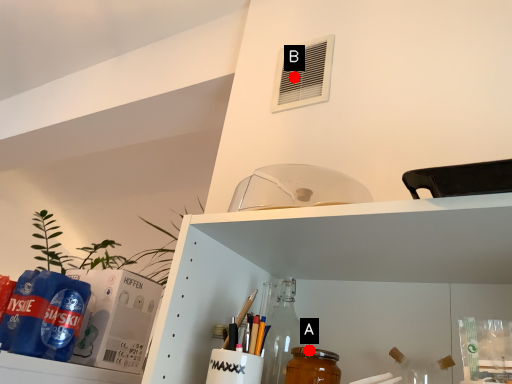
Question: Two points are circled on the image, labeled by A and B beside each circle. Which of the following is the closest to the observer?

Choices:
 (A) A is closer
 (B) B is closer

Answer: (A)